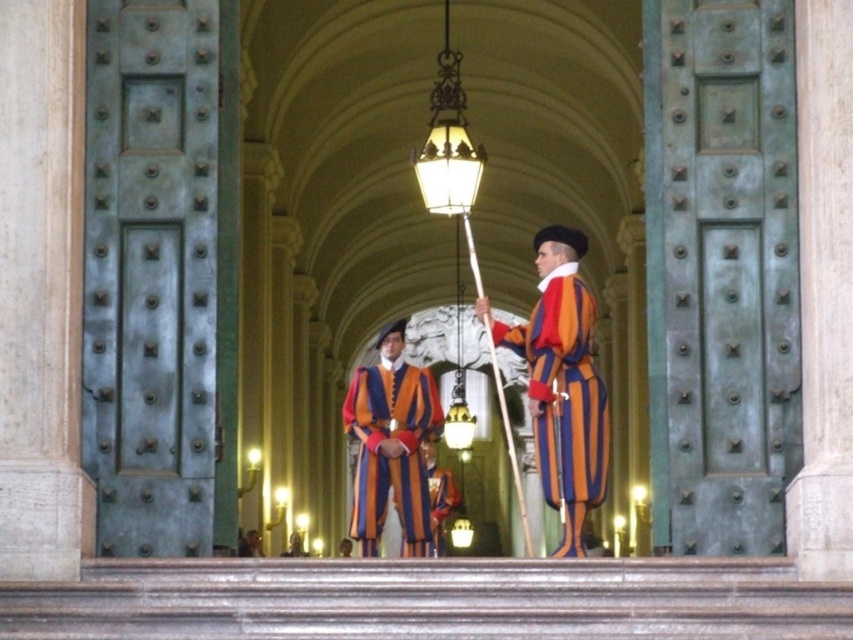
In the grand hallway with arched ceilings, you see two people wearing uniforms. One has a striped velvet uniform at center and the other an orange striped uniform at center. From your perspective, which uniform is positioned to the left?

The striped velvet uniform at center is to the left of the orange striped uniform at center.

Looking at this image, you are a visitor in this grand hallway and see both the orange striped fabric at center and the orange striped uniform at center. Which one is nearer to you?

The orange striped fabric at center is closer to the viewer than the orange striped uniform at center.

You are a visitor in this grand hallway and notice two uniforms at the center. Which one is positioned higher between the striped velvet uniform at center and the orange striped uniform at center?

The striped velvet uniform at center is positioned higher than the orange striped uniform at center.